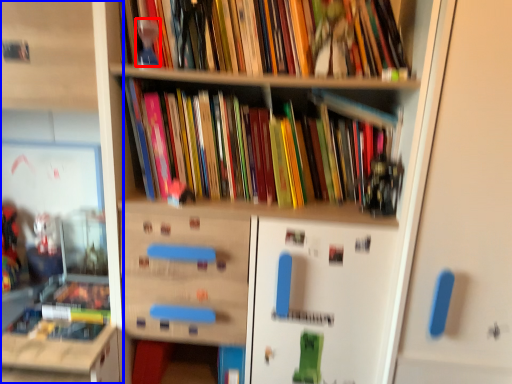
Question: Which object is closer to the camera taking this photo, toy (highlighted by a red box) or shelf (highlighted by a blue box)?

Choices:
 (A) toy
 (B) shelf

Answer: (B)